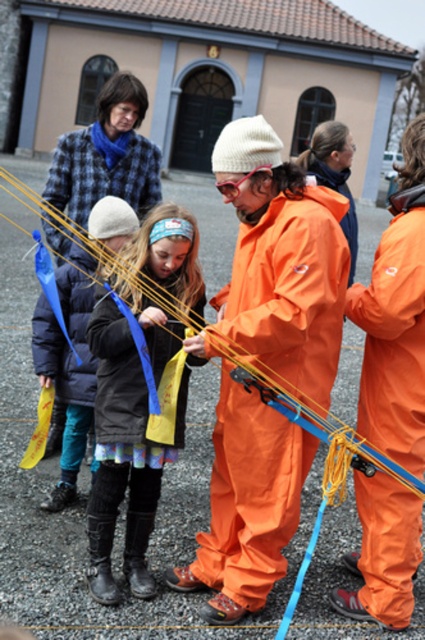
Can you confirm if orange waterproof jumpsuit at center is positioned below orange waterproof suit at center?

Yes, orange waterproof jumpsuit at center is below orange waterproof suit at center.

Does orange waterproof jumpsuit at center have a greater width compared to orange waterproof suit at center?

Indeed, orange waterproof jumpsuit at center has a greater width compared to orange waterproof suit at center.

I want to click on orange waterproof jumpsuit at center, so click(266, 364).

The width and height of the screenshot is (425, 640). Identify the location of orange waterproof jumpsuit at center. (266, 364).

Between orange waterproof jumpsuit at center and fluffy woolen hat at center, which one has less height?

With less height is fluffy woolen hat at center.

Can you confirm if orange waterproof jumpsuit at center is positioned to the left of fluffy woolen hat at center?

No, orange waterproof jumpsuit at center is not to the left of fluffy woolen hat at center.

The image size is (425, 640). Describe the element at coordinates (266, 364) in the screenshot. I see `orange waterproof jumpsuit at center` at that location.

Find the location of a particular element. The width and height of the screenshot is (425, 640). orange waterproof jumpsuit at center is located at coordinates (266, 364).

Image resolution: width=425 pixels, height=640 pixels. What do you see at coordinates (124, 456) in the screenshot?
I see `fluffy woolen hat at center` at bounding box center [124, 456].

The height and width of the screenshot is (640, 425). Identify the location of fluffy woolen hat at center. (124, 456).

Where is `fluffy woolen hat at center`? Image resolution: width=425 pixels, height=640 pixels. fluffy woolen hat at center is located at coordinates (124, 456).